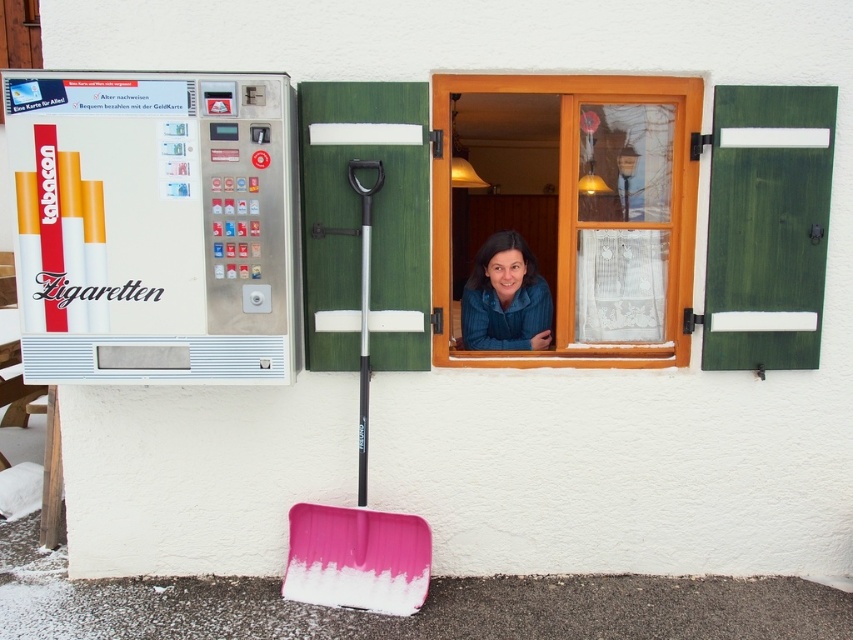
Question: Which point appears farthest from the camera in this image?

Choices:
 (A) (485, 257)
 (B) (294, 278)
 (C) (369, 371)
 (D) (732, 344)

Answer: (A)

Question: Which point is farther to the camera?

Choices:
 (A) metallic silver vending machine at left
 (B) blue textured shirt at window
 (C) wooden window at center
 (D) green wood shutter at upper right

Answer: (B)

Question: Can you confirm if metallic silver vending machine at left is bigger than green wood shutter at upper right?

Choices:
 (A) yes
 (B) no

Answer: (A)

Question: Does green wood shutter at upper right appear on the left side of pink plastic shovel at center?

Choices:
 (A) yes
 (B) no

Answer: (B)

Question: Is wooden window at center thinner than green wood shutter at upper right?

Choices:
 (A) yes
 (B) no

Answer: (B)

Question: Which of the following is the closest to the observer?

Choices:
 (A) (519, 342)
 (B) (799, 355)
 (C) (459, 228)
 (D) (302, 561)

Answer: (B)